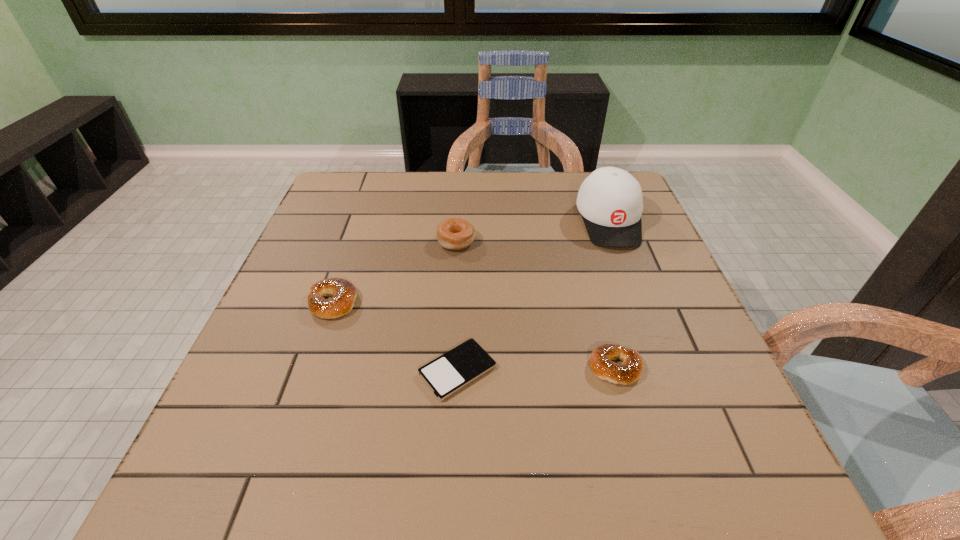
Find the location of a particular element. The height and width of the screenshot is (540, 960). vacant space that's between the baseball cap and the second shortest object is located at coordinates (612, 294).

Locate an element on the screen. free spot between the baseball cap and the shortest object is located at coordinates (533, 296).

Where is `empty space between the farthest bagel and the shortest object`? This screenshot has width=960, height=540. empty space between the farthest bagel and the shortest object is located at coordinates [457, 306].

The width and height of the screenshot is (960, 540). I want to click on free space between the second tallest object and the baseball cap, so click(x=533, y=232).

Identify the location of empty space between the shortest bagel and the tallest object. (612, 294).

Locate an element on the screen. object identified as the closest to the baseball cap is located at coordinates (455, 233).

Where is `object that stands as the third closest to the baseball cap`? The width and height of the screenshot is (960, 540). object that stands as the third closest to the baseball cap is located at coordinates (447, 374).

The height and width of the screenshot is (540, 960). I want to click on bagel that can be found as the second closest to the shortest object, so click(x=630, y=370).

Locate which bagel is the third closest to the iPod. Please provide its 2D coordinates. Your answer should be formatted as a tuple, i.e. [(x, y)], where the tuple contains the x and y coordinates of a point satisfying the conditions above.

[(455, 233)]